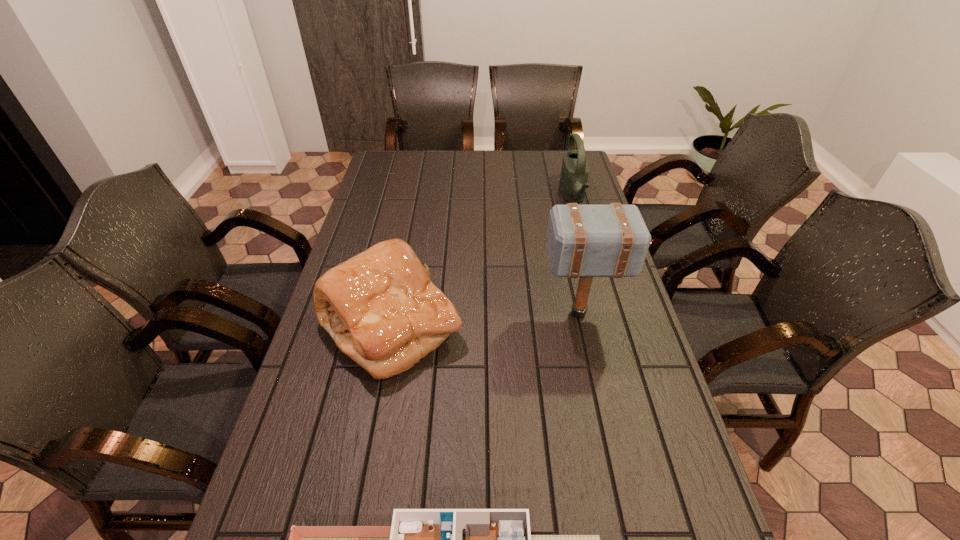
Where is `unoccupied position between the bread and the farthest object`? Image resolution: width=960 pixels, height=540 pixels. unoccupied position between the bread and the farthest object is located at coordinates (482, 261).

Find the location of a particular element. The width and height of the screenshot is (960, 540). empty space that is in between the tallest object and the bread is located at coordinates (485, 319).

You are a GUI agent. You are given a task and a screenshot of the screen. Output one action in this format:
    pyautogui.click(x=<x>, y=<y>)
    Task: Click on the object that stands as the second closest to the bread
    Image resolution: width=960 pixels, height=540 pixels.
    Given the screenshot: What is the action you would take?
    pyautogui.click(x=420, y=539)

What are the coordinates of `object that stands as the closest to the bread` in the screenshot? It's located at (586, 241).